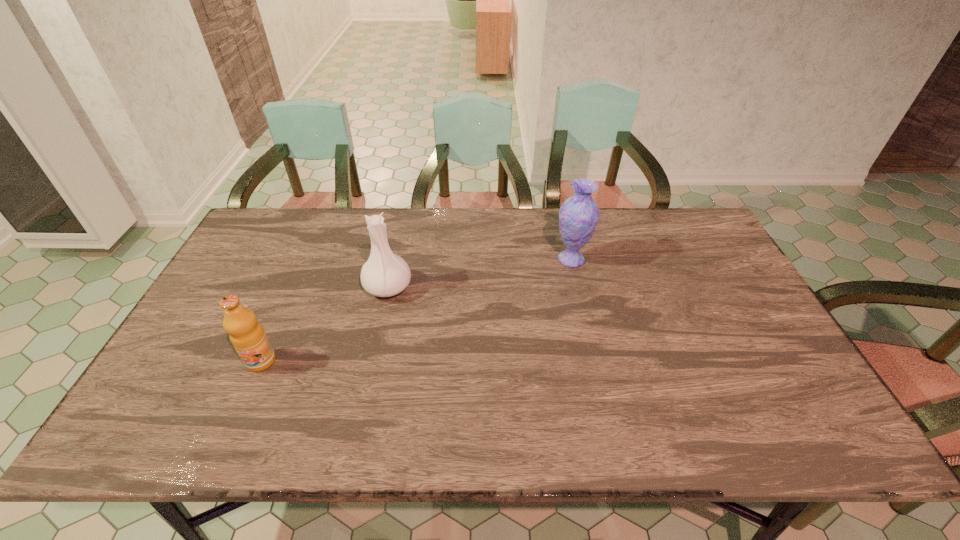
This screenshot has height=540, width=960. In order to click on empty space that is in between the right vase and the fruit juice in this screenshot , I will do `click(416, 310)`.

Where is `vacant space that is in between the rightmost object and the nearest object`? The image size is (960, 540). vacant space that is in between the rightmost object and the nearest object is located at coordinates (416, 310).

Where is `empty space that is in between the leftmost object and the left vase`? Image resolution: width=960 pixels, height=540 pixels. empty space that is in between the leftmost object and the left vase is located at coordinates (324, 324).

The width and height of the screenshot is (960, 540). In order to click on empty space between the second object from left to right and the right vase in this screenshot , I will do `click(480, 273)`.

Where is `vacant space that is in between the nearest object and the left vase`? The height and width of the screenshot is (540, 960). vacant space that is in between the nearest object and the left vase is located at coordinates (324, 324).

Identify which object is the closest to the second object from left to right. Please provide its 2D coordinates. Your answer should be formatted as a tuple, i.e. [(x, y)], where the tuple contains the x and y coordinates of a point satisfying the conditions above.

[(246, 334)]

Locate an element on the screen. object that is the closest one to the right vase is located at coordinates (385, 274).